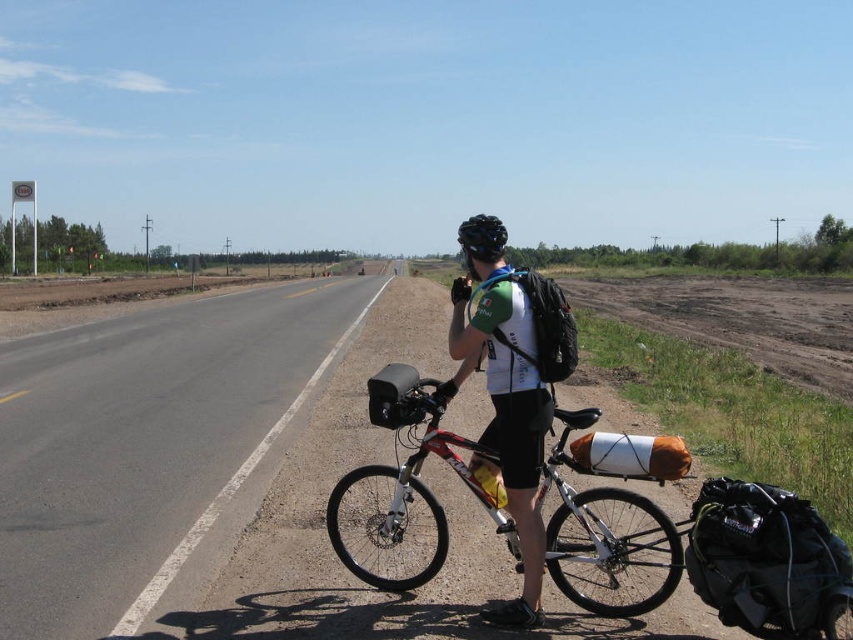
Question: Where is shiny metallic bicycle at center located in relation to white fabric shirt at center in the image?

Choices:
 (A) above
 (B) below

Answer: (B)

Question: Does shiny metallic bicycle at center have a lesser width compared to black matte bicycle helmet at center?

Choices:
 (A) yes
 (B) no

Answer: (B)

Question: Does asphalt road at left appear on the right side of shiny metallic bicycle at center?

Choices:
 (A) no
 (B) yes

Answer: (A)

Question: Which point is closer to the camera taking this photo?

Choices:
 (A) (483, 244)
 (B) (518, 387)
 (C) (393, 413)

Answer: (B)

Question: Which point is closer to the camera?

Choices:
 (A) white fabric shirt at center
 (B) asphalt road at left
 (C) black matte bicycle helmet at center
 (D) shiny metallic bicycle at center

Answer: (D)

Question: Which of the following is the farthest from the observer?

Choices:
 (A) black matte bicycle helmet at center
 (B) shiny metallic bicycle at center
 (C) white fabric shirt at center

Answer: (A)